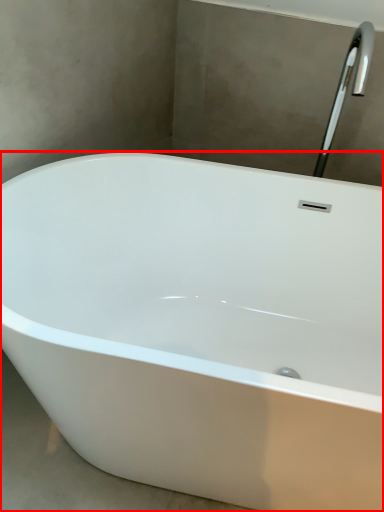
Question: From the image's perspective, considering the relative positions of bathtub (annotated by the red box) and tap in the image provided, where is bathtub (annotated by the red box) located with respect to the staircase?

Choices:
 (A) below
 (B) above

Answer: (A)